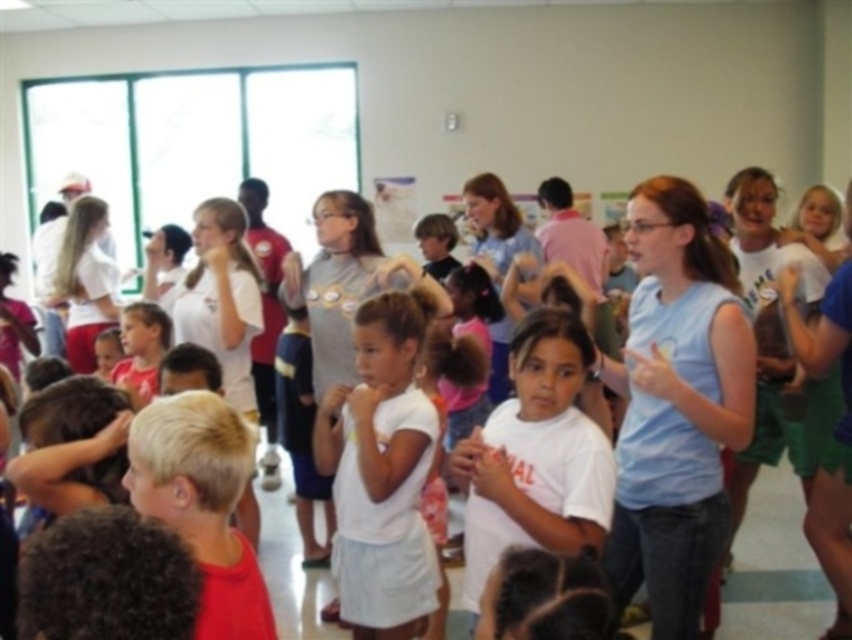
Question: Estimate the real-world distances between objects in this image. Which object is closer to the white matte shirt at center?

Choices:
 (A) white cotton shirt at center
 (B) light blue sleeveless shirt at center

Answer: (B)

Question: In this image, where is light blue sleeveless shirt at center located relative to white matte shirt at center?

Choices:
 (A) below
 (B) above

Answer: (B)

Question: Which point is closer to the camera?

Choices:
 (A) (540, 444)
 (B) (683, 262)
 (C) (321, 412)

Answer: (A)

Question: From the image, what is the correct spatial relationship of light blue sleeveless shirt at center in relation to white cotton shirt at center?

Choices:
 (A) left
 (B) right

Answer: (B)

Question: Which of the following is the farthest from the observer?

Choices:
 (A) (x=704, y=307)
 (B) (x=579, y=385)

Answer: (A)

Question: Does light blue sleeveless shirt at center have a lesser width compared to white cotton shirt at center?

Choices:
 (A) yes
 (B) no

Answer: (B)